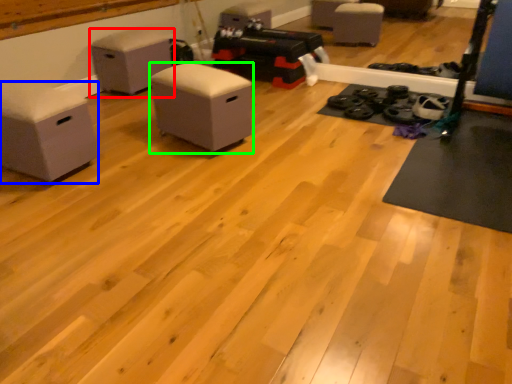
Question: Considering the real-world distances, which object is closest to furniture (highlighted by a red box)? furniture (highlighted by a blue box) or furniture (highlighted by a green box).

Choices:
 (A) furniture
 (B) furniture

Answer: (B)